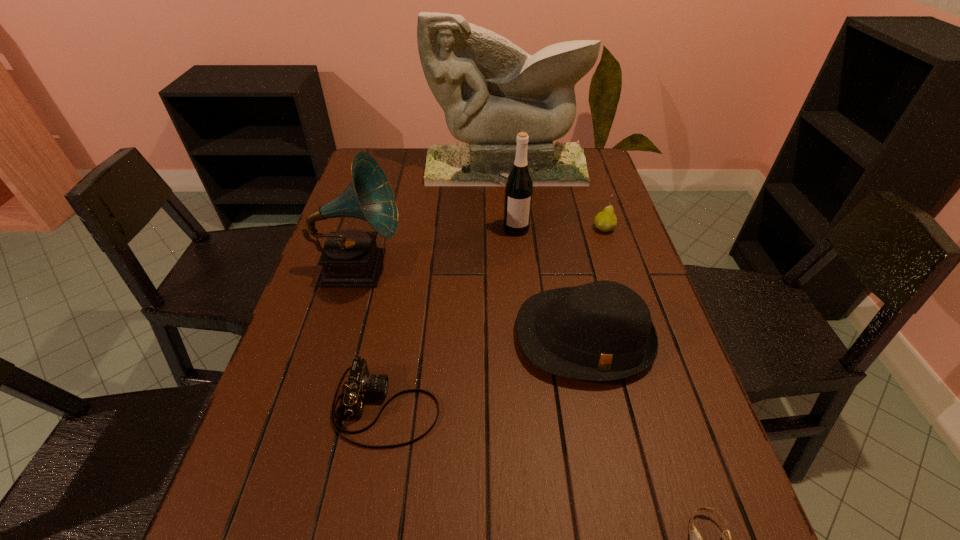
At what (x,y) coordinates should I click in order to perform the action: click on the farthest object. Please return your answer as a coordinate pair (x, y). Looking at the image, I should click on (490, 89).

At what (x,y) coordinates should I click in order to perform the action: click on sculpture. Please return your answer as a coordinate pair (x, y). Looking at the image, I should click on (490, 89).

Locate an element on the screen. This screenshot has height=540, width=960. phonograph_record is located at coordinates (350, 258).

Locate an element on the screen. The image size is (960, 540). wine bottle is located at coordinates [x=519, y=186].

At what (x,y) coordinates should I click in order to perform the action: click on the fourth shortest object. Please return your answer as a coordinate pair (x, y). The width and height of the screenshot is (960, 540). Looking at the image, I should click on (600, 331).

I want to click on the third shortest object, so click(x=606, y=220).

This screenshot has height=540, width=960. In order to click on the second shortest object in this screenshot , I will do `click(360, 383)`.

The width and height of the screenshot is (960, 540). I want to click on vacant space situated 0.050m on the base of the farthest object, so click(x=508, y=194).

The width and height of the screenshot is (960, 540). What are the coordinates of `vacant space located from the horn of the phonograph_record` in the screenshot? It's located at (541, 268).

Where is `vacant space located 0.250m on the label of the wine bottle`? vacant space located 0.250m on the label of the wine bottle is located at coordinates (523, 300).